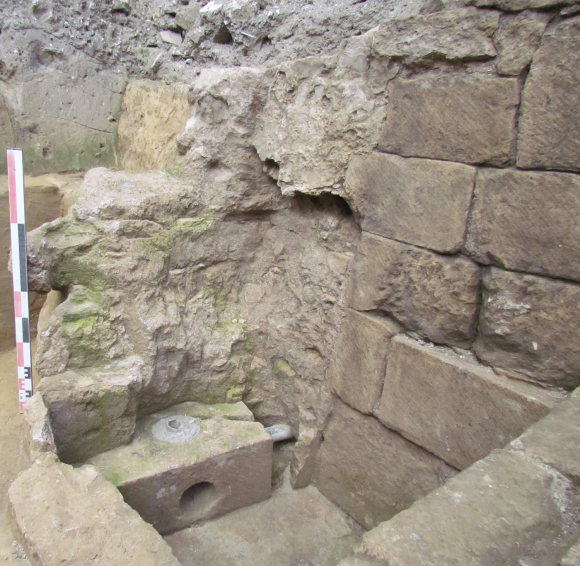
Where is `floor`? The height and width of the screenshot is (566, 580). floor is located at coordinates [295, 505].